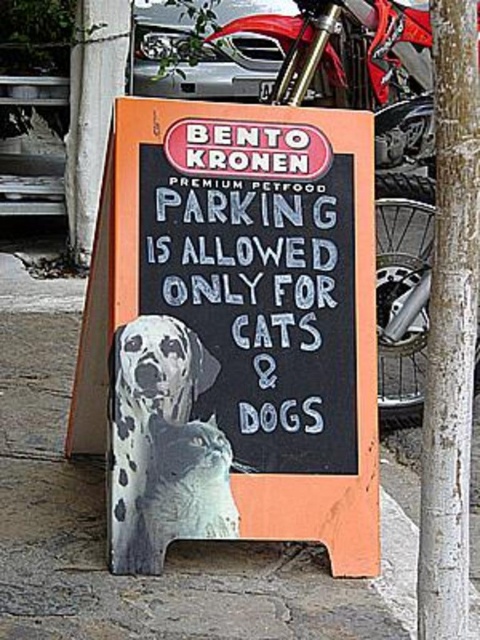
You are a pet owner walking your two dogs, a spotted fur dog at center and a white fur dog at center, and you see the sandwich board sign. According to the sign, can both of your dogs park here?

The spotted fur dog at center is above the white fur dog at center on the sign, but the sign states that parking is allowed only for cats and dogs. Since both of your dogs are dogs, they are allowed to park here.